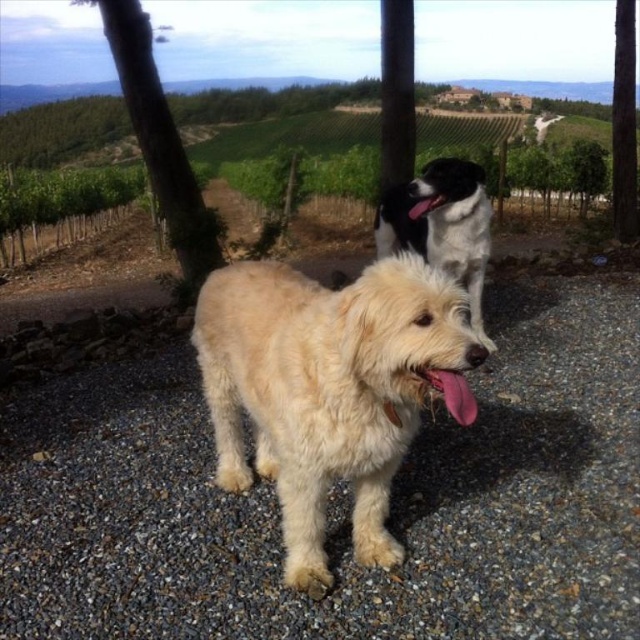
Question: Which point appears closest to the camera in this image?

Choices:
 (A) (403, 275)
 (B) (376, 244)

Answer: (A)

Question: Is white gravel at center further to the viewer compared to black and white fur dog at upper center?

Choices:
 (A) no
 (B) yes

Answer: (A)

Question: Does white gravel at center have a larger size compared to fuzzy beige dog at center?

Choices:
 (A) no
 (B) yes

Answer: (B)

Question: Can you confirm if white gravel at center is positioned below fuzzy beige dog at center?

Choices:
 (A) no
 (B) yes

Answer: (B)

Question: Estimate the real-world distances between objects in this image. Which object is farther from the black and white fur dog at upper center?

Choices:
 (A) white gravel at center
 (B) fuzzy beige dog at center

Answer: (B)

Question: Which of the following is the closest to the observer?

Choices:
 (A) (516, 323)
 (B) (230, 456)

Answer: (B)